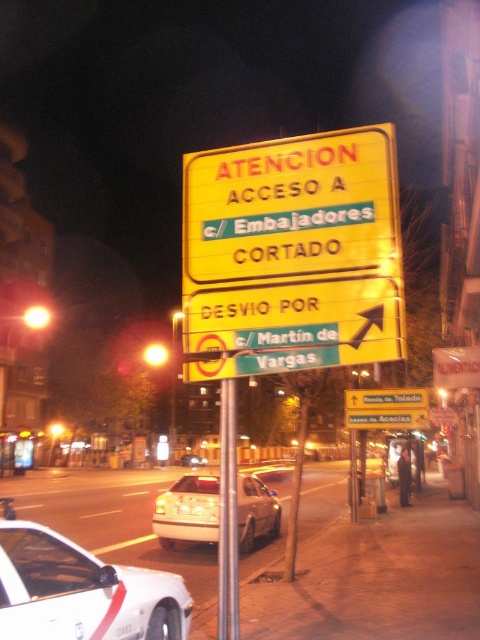
Question: Which point is closer to the camera taking this photo?

Choices:
 (A) (427, 397)
 (B) (375, 412)
 (C) (229, 570)

Answer: (C)

Question: Does white glossy car at lower left have a larger size compared to silver metallic car at center?

Choices:
 (A) no
 (B) yes

Answer: (B)

Question: Which object is the closest to the yellow matte sign at upper center?

Choices:
 (A) metallic pole at center
 (B) silver metallic car at center
 (C) white glossy car at lower left

Answer: (A)

Question: Does white glossy car at lower left come in front of yellow matte sign at upper center?

Choices:
 (A) yes
 (B) no

Answer: (A)

Question: Is white glossy car at lower left wider than white metallic sedan at center?

Choices:
 (A) yes
 (B) no

Answer: (B)

Question: Considering the real-world distances, which object is farthest from the metallic pole at center?

Choices:
 (A) yellow plastic sign at center
 (B) yellow matte sign at upper center
 (C) white glossy car at lower left
 (D) silver metallic car at center

Answer: (D)